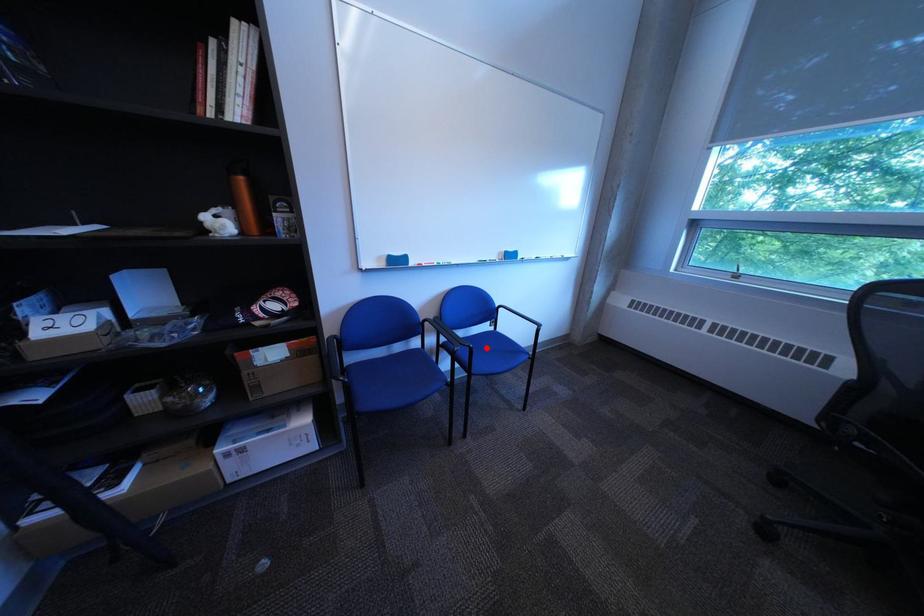
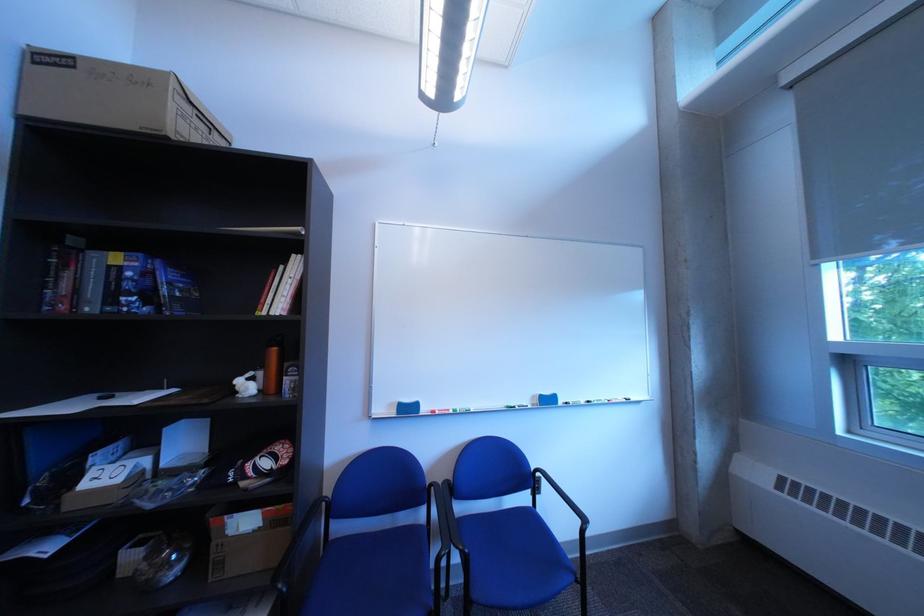
Question: I am providing you with two images of the same scene from different viewpoints. Image1 has a red point marked. In image2, the corresponding 3D location appears at what relative position? Reply with the corresponding letter.

Choices:
 (A) Closer
 (B) Farther

Answer: (A)